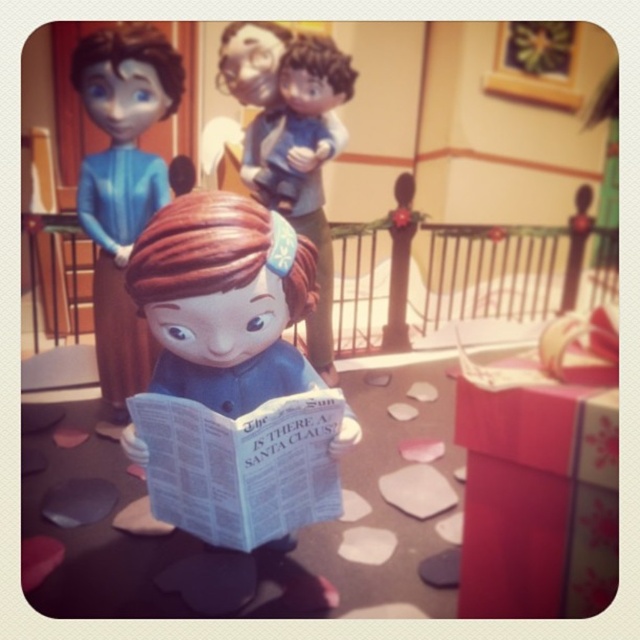
You are a child trying to reach both the white paper book at center and the matte blue doll at center. Which object can you grab first without moving your position?

The white paper book at center is in front of the matte blue doll at center, so you can grab the white paper book at center first without moving your position.

What is located at the coordinates point (241, 465) in the image?

The white paper book at center is located at point (241, 465).

You are a visitor in this scene and want to place a new decoration exactly at the center of the image. However, there is a white paper book at center. Can you place your decoration without overlapping it?

The white paper book at center is located at point (x=241, y=465), so you need to place your decoration elsewhere to avoid overlapping.